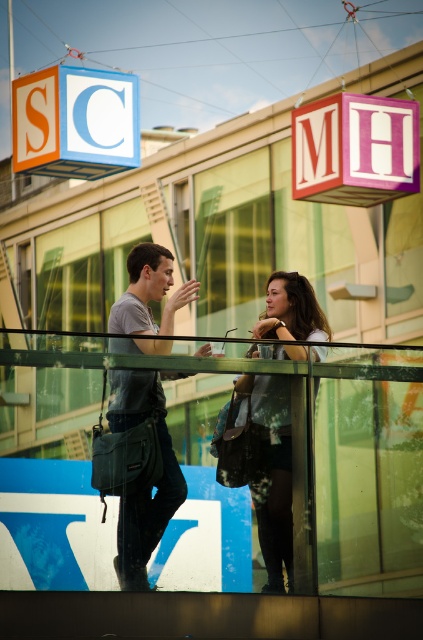
Is point (164, 449) behind point (184, 497)?

Yes, point (164, 449) is behind point (184, 497).

Is denim jacket at center thinner than denim jeans at center?

Incorrect, denim jacket at center's width is not less than denim jeans at center's.

Find the location of a particular element. denim jacket at center is located at coordinates (145, 490).

Find the location of a particular element. This screenshot has width=423, height=640. denim jacket at center is located at coordinates (145, 490).

Is denim jeans at center thinner than orange matte cube at upper left?

Yes, denim jeans at center is thinner than orange matte cube at upper left.

Does denim jeans at center come in front of orange matte cube at upper left?

That is True.

Locate an element on the screen. denim jeans at center is located at coordinates (145, 488).

Who is more forward, (117, 307) or (54, 134)?

Point (117, 307)

Is point (307, 316) behind point (80, 88)?

No, it is not.

Is point (120, 512) positioned before point (87, 154)?

Yes, point (120, 512) is in front of point (87, 154).

This screenshot has width=423, height=640. Identify the location of denim jacket at center. click(145, 490).